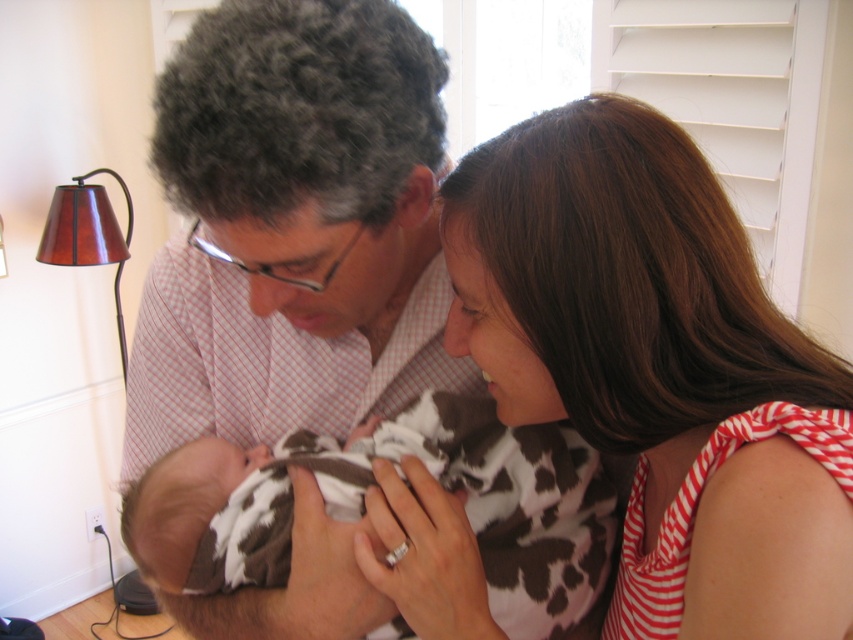
Which is below, matte pink shirt at center or striped fabric dress at center?

striped fabric dress at center is lower down.

At what (x,y) coordinates should I click in order to perform the action: click on matte pink shirt at center. Please return your answer as a coordinate pair (x, y). Looking at the image, I should click on (285, 285).

What do you see at coordinates (285, 285) in the screenshot?
I see `matte pink shirt at center` at bounding box center [285, 285].

Locate an element on the screen. Image resolution: width=853 pixels, height=640 pixels. matte pink shirt at center is located at coordinates (285, 285).

Which is more to the right, striped fabric dress at center or cow print fabric at center?

striped fabric dress at center

Between point (604, 371) and point (514, 544), which one is positioned behind?

Positioned behind is point (514, 544).

The width and height of the screenshot is (853, 640). What are the coordinates of `striped fabric dress at center` in the screenshot? It's located at (642, 316).

Does matte pink shirt at center lie in front of cow print fabric at center?

Yes, it is.

Does point (329, 116) come behind point (270, 484)?

No, (329, 116) is closer to viewer.

Identify the location of matte pink shirt at center. This screenshot has width=853, height=640. (285, 285).